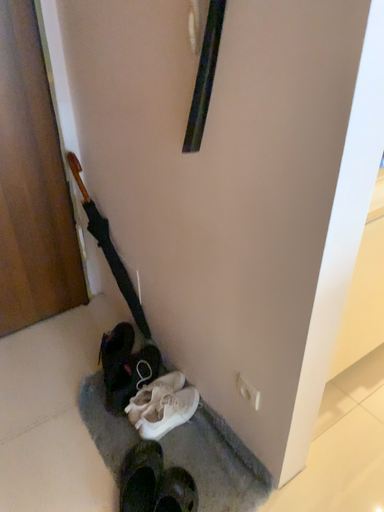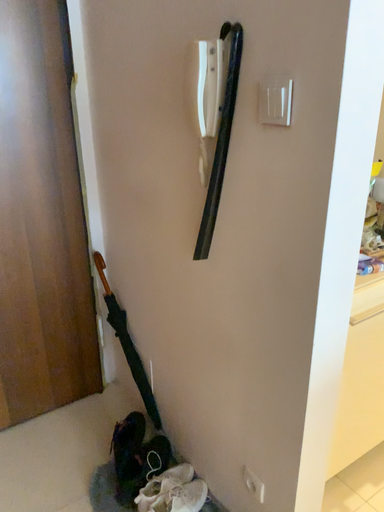
Question: How did the camera likely rotate when shooting the video?

Choices:
 (A) rotated downward
 (B) rotated upward

Answer: (B)